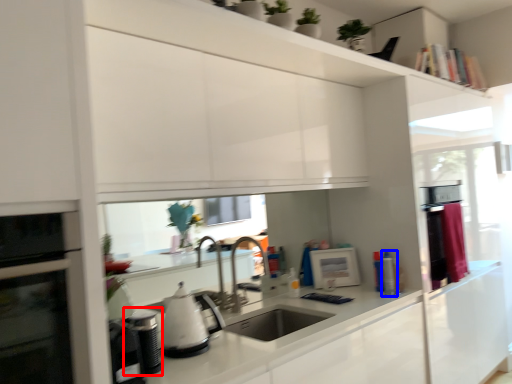
Question: Which object is further to the camera taking this photo, appliance (highlighted by a red box) or appliance (highlighted by a blue box)?

Choices:
 (A) appliance
 (B) appliance

Answer: (B)